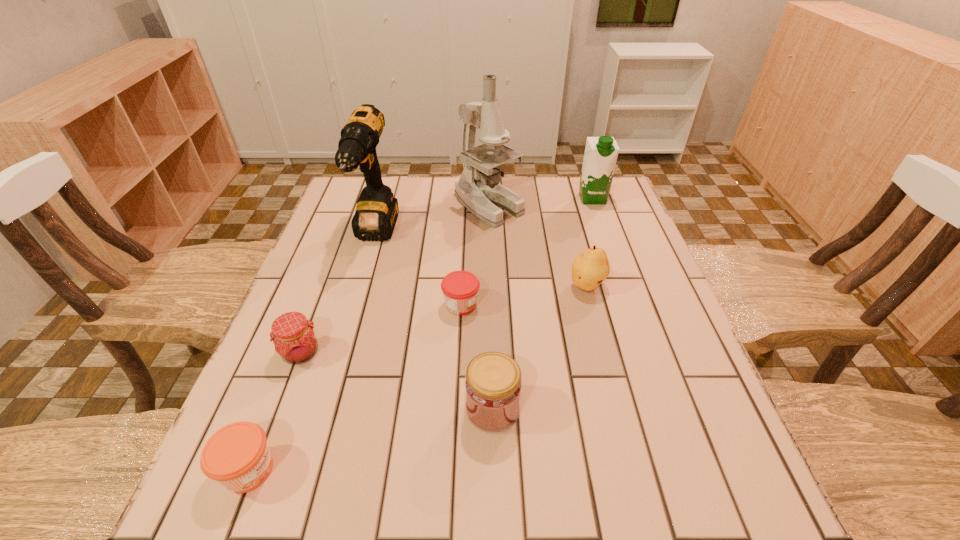
I want to click on free region located at the tip of the drill, so click(353, 310).

Locate an element on the screen. vacant space located 0.240m on the front-facing side of the third tallest object is located at coordinates (612, 256).

Locate an element on the screen. free location located 0.120m on the right of the pear is located at coordinates (654, 286).

Locate an element on the screen. The height and width of the screenshot is (540, 960). vacant space located on the left of the second nearest object is located at coordinates (406, 409).

This screenshot has height=540, width=960. In order to click on free space located 0.380m on the back of the sixth farthest object in this screenshot , I will do `click(346, 234)`.

Where is `vacant region located 0.360m on the front label of the nearest object`? The width and height of the screenshot is (960, 540). vacant region located 0.360m on the front label of the nearest object is located at coordinates click(x=490, y=470).

Identify the location of free space located on the label side of the farthest jam. (603, 305).

Identify the location of microscope that is at the far edge. The image size is (960, 540). 478,189.

Identify the location of drill at the far edge. Image resolution: width=960 pixels, height=540 pixels. (376, 213).

You are a GUI agent. You are given a task and a screenshot of the screen. Output one action in this format:
    pyautogui.click(x=<x>, y=<y>)
    Task: Click on the soya milk positioned at the far edge
    
    Given the screenshot: What is the action you would take?
    click(601, 153)